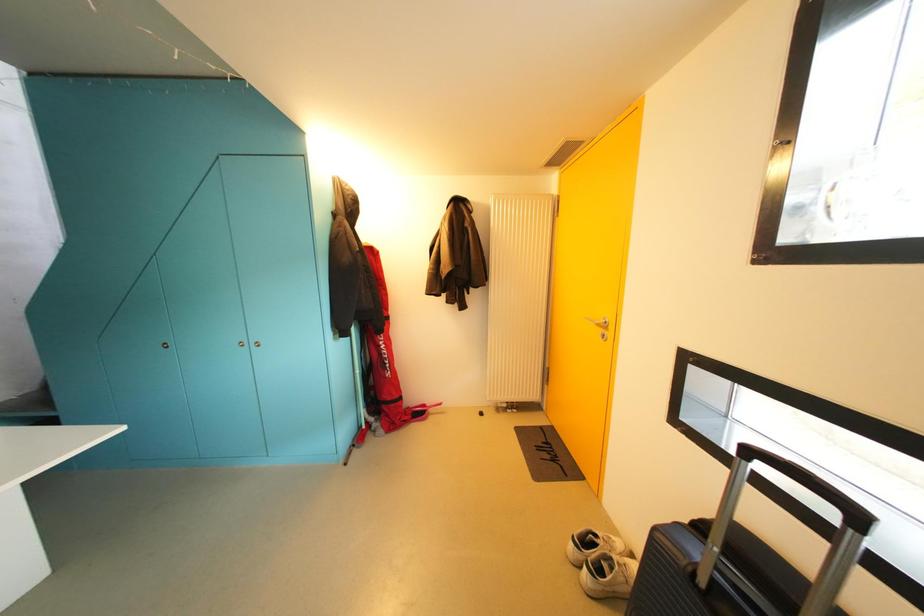
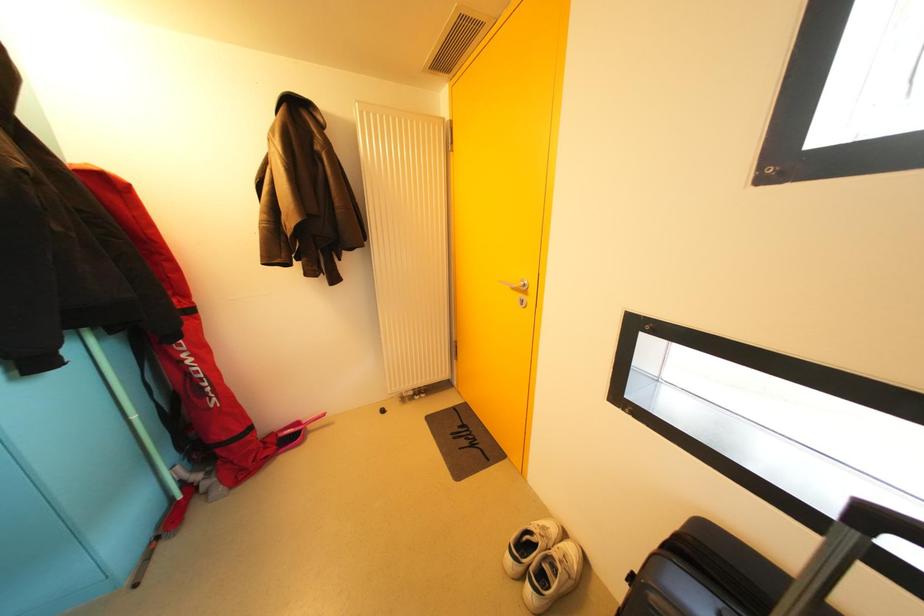
Question: The images are taken continuously from a first-person perspective. In which direction is your viewpoint rotating?

Choices:
 (A) Left
 (B) Right
 (C) Up
 (D) Down

Answer: (B)